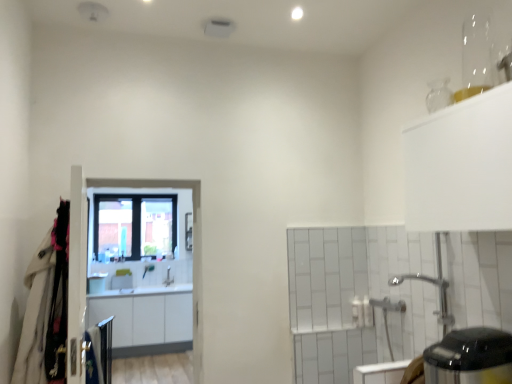
Question: Can you confirm if clear glass window at center is wider than white fabric coat at left?

Choices:
 (A) no
 (B) yes

Answer: (A)

Question: From a real-world perspective, is clear glass window at center located higher than white fabric coat at left?

Choices:
 (A) yes
 (B) no

Answer: (A)

Question: Is clear glass window at center positioned behind white fabric coat at left?

Choices:
 (A) yes
 (B) no

Answer: (A)

Question: Considering the relative sizes of clear glass window at center and white fabric coat at left in the image provided, is clear glass window at center bigger than white fabric coat at left?

Choices:
 (A) yes
 (B) no

Answer: (A)

Question: Is the position of clear glass window at center less distant than that of white fabric coat at left?

Choices:
 (A) no
 (B) yes

Answer: (A)

Question: Is clear glass window at center taller than white fabric coat at left?

Choices:
 (A) yes
 (B) no

Answer: (A)

Question: Is white fabric coat at left not close to clear glass window at center?

Choices:
 (A) no
 (B) yes

Answer: (B)

Question: Can we say white fabric coat at left lies outside clear glass window at center?

Choices:
 (A) yes
 (B) no

Answer: (A)

Question: From a real-world perspective, is white fabric coat at left positioned under clear glass window at center based on gravity?

Choices:
 (A) no
 (B) yes

Answer: (B)

Question: Does white fabric coat at left have a greater width compared to clear glass window at center?

Choices:
 (A) no
 (B) yes

Answer: (B)

Question: Can you confirm if white fabric coat at left is thinner than clear glass window at center?

Choices:
 (A) no
 (B) yes

Answer: (A)

Question: Is white fabric coat at left taller than clear glass window at center?

Choices:
 (A) yes
 (B) no

Answer: (B)

Question: Is white fabric coat at left completely or partially outside of white glossy screen door at center?

Choices:
 (A) no
 (B) yes

Answer: (B)